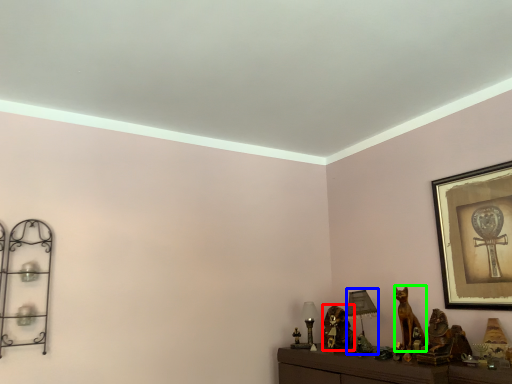
Question: Considering the real-world distances, which object is closest to animal (highlighted by a red box)? table lamp (highlighted by a blue box) or animal (highlighted by a green box).

Choices:
 (A) table lamp
 (B) animal

Answer: (A)